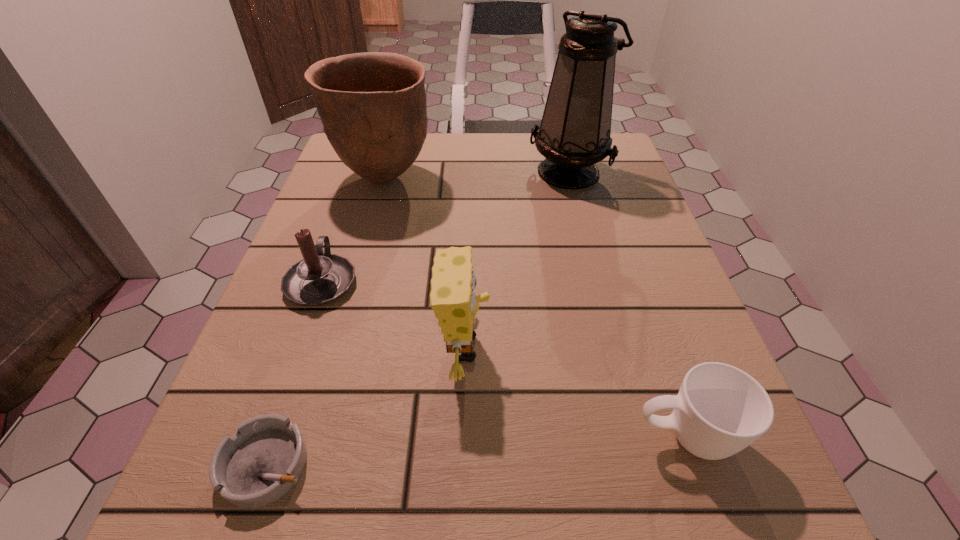
Find the location of a particular element. free region that satisfies the following two spatial constraints: 1. on the side of the fifth shortest object with the handle loop; 2. on the left side of the candle is located at coordinates (359, 178).